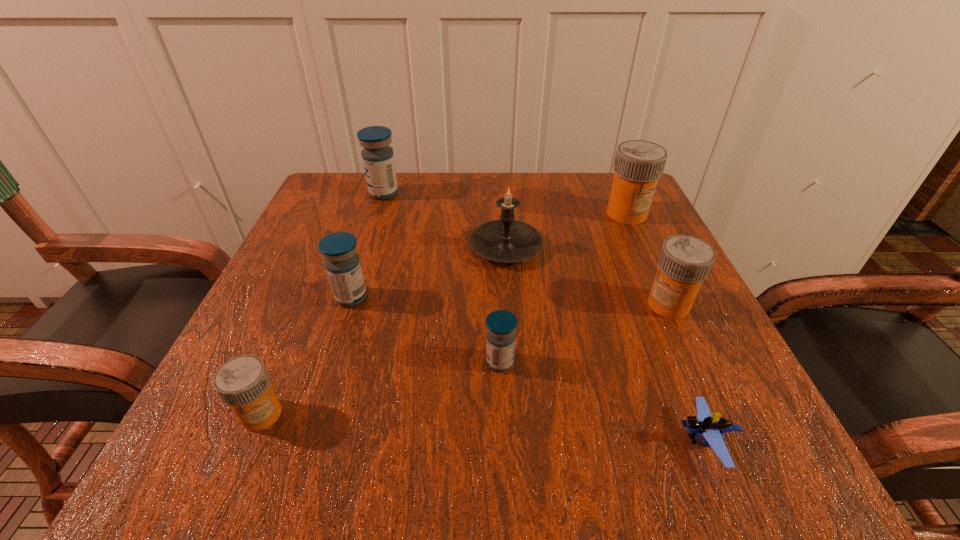
Where is `the nearest orange medicine`? The image size is (960, 540). the nearest orange medicine is located at coordinates (243, 382).

This screenshot has height=540, width=960. I want to click on the shortest object, so click(711, 428).

The image size is (960, 540). Identify the location of Lego. (711, 428).

The image size is (960, 540). I want to click on blank space located on the right of the farthest object, so click(539, 193).

At what (x,y) coordinates should I click in order to perform the action: click on free point located on the label side of the biggest orange medicine. Please return your answer as a coordinate pair (x, y). Looking at the image, I should click on (691, 354).

Where is `free region located 0.110m on the front of the sixth nearest object`? free region located 0.110m on the front of the sixth nearest object is located at coordinates (511, 313).

You are a GUI agent. You are given a task and a screenshot of the screen. Output one action in this format:
    pyautogui.click(x=<x>, y=<y>)
    Task: Click on the free space located on the label side of the second nearest orange medicine
    The width and height of the screenshot is (960, 540).
    Given the screenshot: What is the action you would take?
    pyautogui.click(x=496, y=304)

At what (x,y) coordinates should I click in order to perform the action: click on free location located on the label side of the second nearest orange medicine. Please return your answer as a coordinate pair (x, y). Looking at the image, I should click on (496, 304).

Locate an element on the screen. The height and width of the screenshot is (540, 960). vacant space located on the label side of the second nearest orange medicine is located at coordinates (485, 304).

Find the location of a particular element. The image size is (960, 540). vacant space located on the right of the second nearest blue medicine is located at coordinates (594, 298).